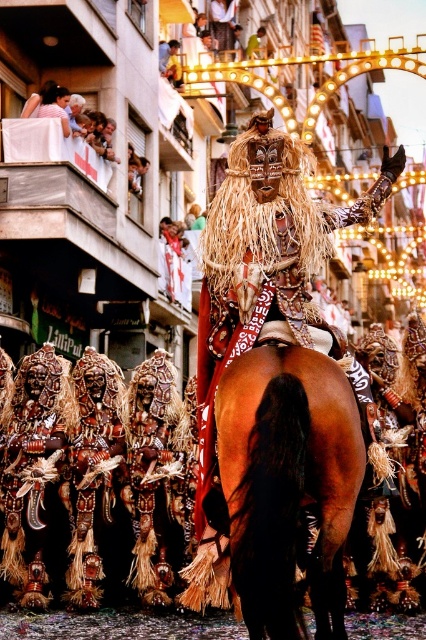
Question: Which of these objects is positioned farthest from the shiny metallic mask at center?

Choices:
 (A) brown glossy horse at center
 (B) light brown wooden balcony at upper left

Answer: (B)

Question: Considering the real-world distances, which object is closest to the brown glossy horse at center?

Choices:
 (A) shiny metallic mask at center
 (B) light brown wooden balcony at upper left

Answer: (A)

Question: Can you confirm if shiny metallic mask at center is thinner than brown glossy horse at center?

Choices:
 (A) yes
 (B) no

Answer: (B)

Question: Among these objects, which one is farthest from the camera?

Choices:
 (A) shiny metallic mask at center
 (B) brown glossy horse at center

Answer: (A)

Question: Does shiny metallic mask at center have a lesser width compared to light brown wooden balcony at upper left?

Choices:
 (A) no
 (B) yes

Answer: (A)

Question: Is brown glossy horse at center smaller than light brown wooden balcony at upper left?

Choices:
 (A) yes
 (B) no

Answer: (A)